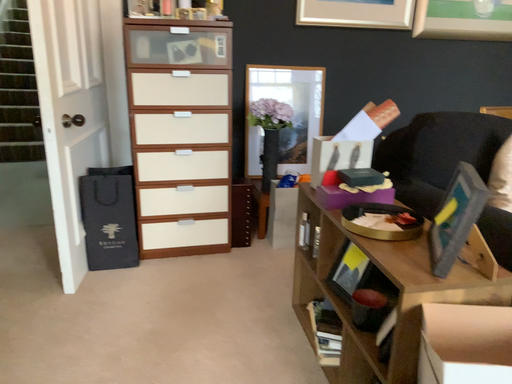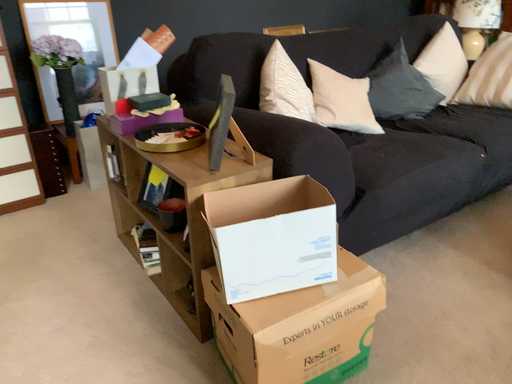
Question: Which way did the camera rotate in the video?

Choices:
 (A) rotated right
 (B) rotated left

Answer: (A)